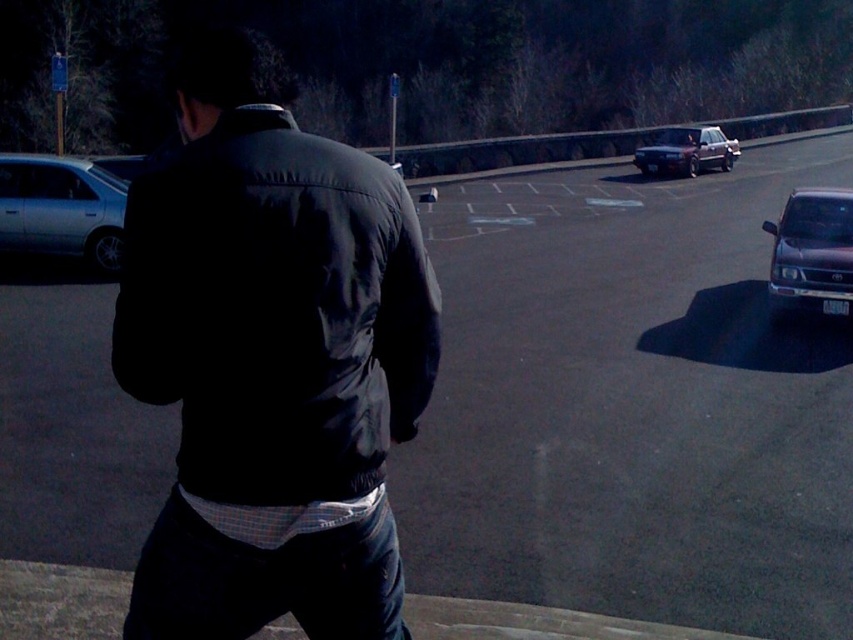
Who is shorter, silver metallic sedan at left or shiny dark gray suv at right?

shiny dark gray suv at right

You are a GUI agent. You are given a task and a screenshot of the screen. Output one action in this format:
    pyautogui.click(x=<x>, y=<y>)
    Task: Click on the silver metallic sedan at left
    
    Given the screenshot: What is the action you would take?
    pyautogui.click(x=61, y=209)

Between point (18, 208) and point (846, 205), which one is positioned in front?

Point (846, 205)

Locate an element on the screen. The width and height of the screenshot is (853, 640). silver metallic sedan at left is located at coordinates (61, 209).

Is the position of matte black jacket at center less distant than that of silver metallic sedan at left?

Yes.

Locate an element on the screen. matte black jacket at center is located at coordinates (276, 310).

Locate an element on the screen. The image size is (853, 640). matte black jacket at center is located at coordinates (276, 310).

Between point (293, 291) and point (701, 141), which one is positioned behind?

Point (701, 141)

Can you confirm if matte black jacket at center is bigger than matte black sedan at upper right?

Actually, matte black jacket at center might be smaller than matte black sedan at upper right.

Which is behind, point (289, 356) or point (718, 128)?

Positioned behind is point (718, 128).

This screenshot has width=853, height=640. I want to click on matte black jacket at center, so click(x=276, y=310).